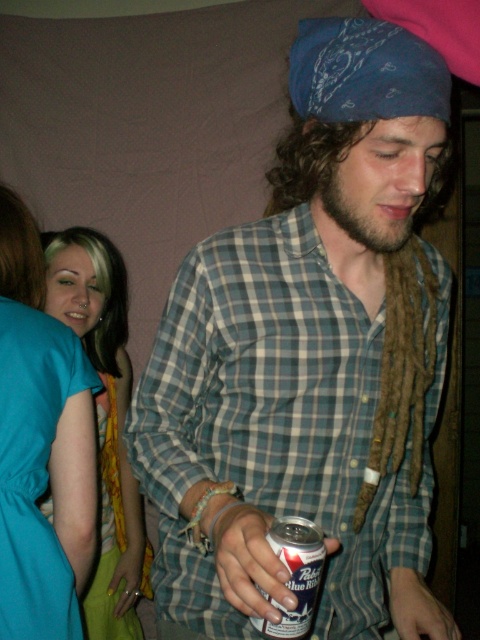
Does checkered fabric shirt at center have a greater height compared to teal fabric dress at left?

Incorrect, checkered fabric shirt at center's height is not larger of teal fabric dress at left's.

Which is more to the left, checkered fabric shirt at center or teal fabric dress at left?

From the viewer's perspective, teal fabric dress at left appears more on the left side.

Where is `checkered fabric shirt at center`? The height and width of the screenshot is (640, 480). checkered fabric shirt at center is located at coordinates (308, 358).

Which is below, teal satin dress at left or silver metallic can at center?

Positioned lower is silver metallic can at center.

Find the location of a particular element. This screenshot has height=640, width=480. teal satin dress at left is located at coordinates (34, 472).

Is point (22, 545) positioned behind point (297, 528)?

Yes, point (22, 545) is behind point (297, 528).

Identify the location of teal satin dress at left. (34, 472).

Can you confirm if checkered fabric shirt at center is wider than teal satin dress at left?

Yes, checkered fabric shirt at center is wider than teal satin dress at left.

Between point (172, 456) and point (1, 588), which one is positioned behind?

Point (1, 588)

Find the location of a particular element. This screenshot has width=480, height=640. checkered fabric shirt at center is located at coordinates (308, 358).